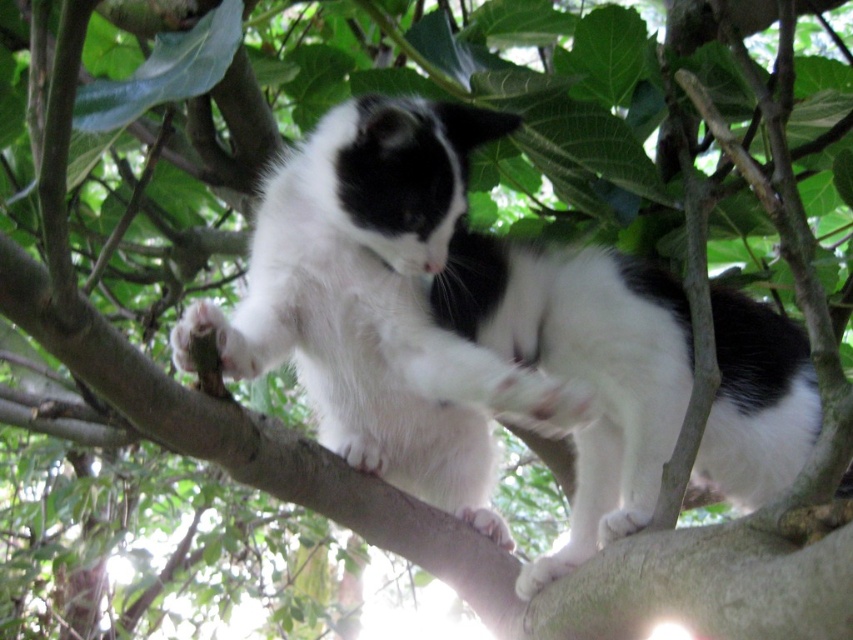
You are a wildlife photographer trying to capture a clear photo of the white fluffy cat at center and the black and white fur at center. Which one should you focus on first to ensure both are in focus?

The white fluffy cat at center is in front of the black and white fur at center, so you should focus on the white fluffy cat at center first to ensure both are in focus.

You are a wildlife photographer trying to capture the white fluffy cat at center and the black and white fur at center in a single frame. Based on their sizes, which one would you need to zoom in more on to ensure clarity?

The black and white fur at center is smaller in size compared to the white fluffy cat at center, so you would need to zoom in more on the black and white fur at center to ensure clarity.

You are a photographer trying to capture the cat in the image. You notice two points of interest marked as point (358, 246) and point (193, 300). Which point is closer to your camera lens?

Point (358, 246) is closer to the camera lens than point (193, 300).